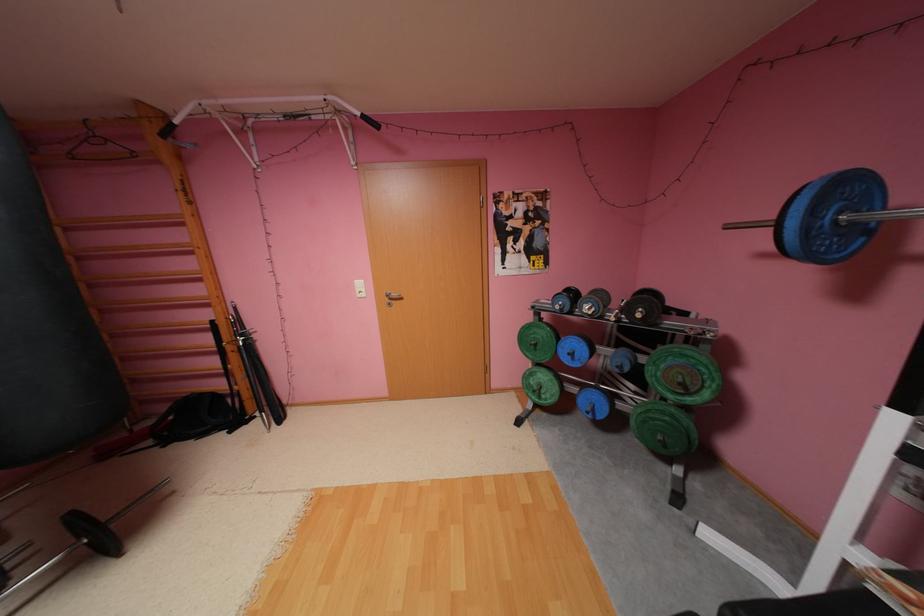
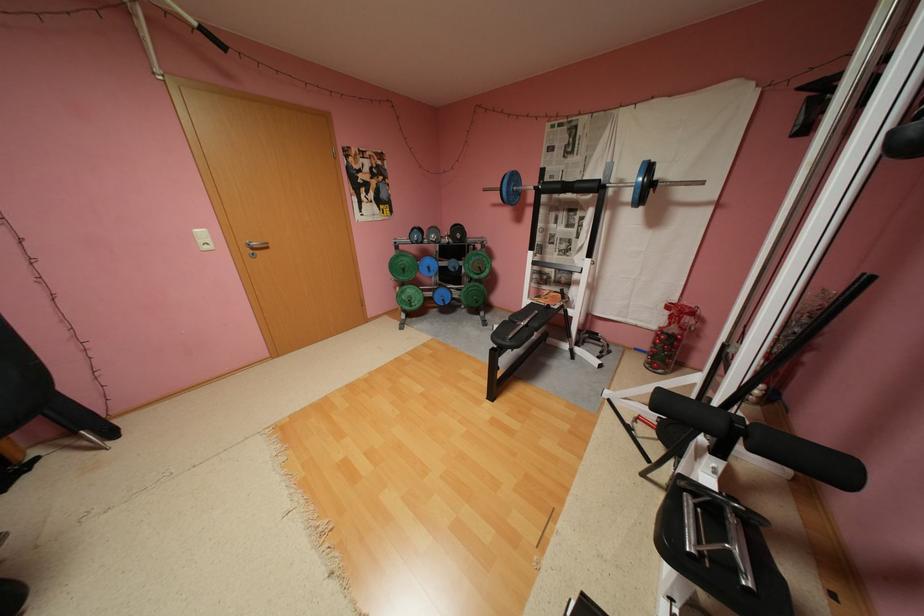
Question: I am providing you with two images of the same scene from different viewpoints. After the viewpoint changes to image2, which objects are now occluded?

Choices:
 (A) blue weight plate
 (B) black foam leg pad
 (C) white light switch
 (D) none of these

Answer: (D)